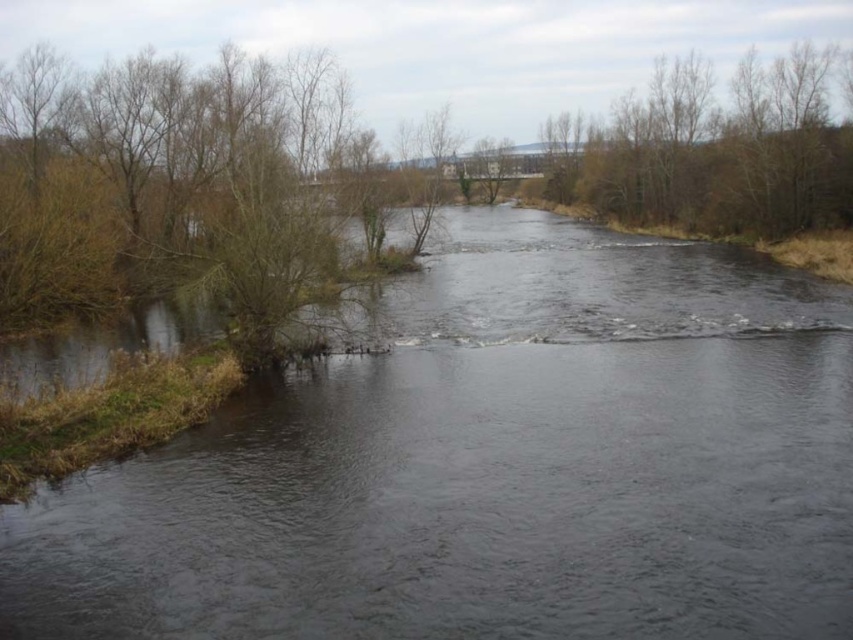
Question: Is dark water at center wider than brown leafy trees at upper right?

Choices:
 (A) no
 (B) yes

Answer: (B)

Question: Which object appears closest to the camera in this image?

Choices:
 (A) dark water at center
 (B) brown leafy trees at upper right

Answer: (A)

Question: Is dark water at center thinner than brown leafy trees at upper right?

Choices:
 (A) no
 (B) yes

Answer: (A)

Question: Which of the following is the closest to the observer?

Choices:
 (A) (643, 259)
 (B) (730, 145)

Answer: (A)

Question: Does dark water at center appear on the right side of brown leafy trees at upper right?

Choices:
 (A) no
 (B) yes

Answer: (A)